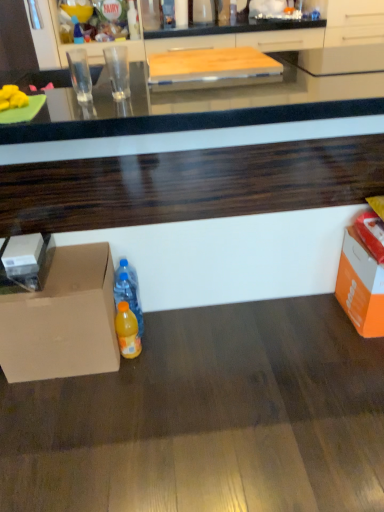
Question: Is yellow matte bananas at left looking in the opposite direction of orange cardboard box at lower right?

Choices:
 (A) yes
 (B) no

Answer: (B)

Question: Considering the relative sizes of yellow matte bananas at left and orange cardboard box at lower right in the image provided, is yellow matte bananas at left shorter than orange cardboard box at lower right?

Choices:
 (A) no
 (B) yes

Answer: (B)

Question: Is yellow matte bananas at left bigger than orange cardboard box at lower right?

Choices:
 (A) yes
 (B) no

Answer: (B)

Question: Is yellow matte bananas at left not near orange cardboard box at lower right?

Choices:
 (A) no
 (B) yes

Answer: (B)

Question: Is yellow matte bananas at left positioned before orange cardboard box at lower right?

Choices:
 (A) yes
 (B) no

Answer: (A)

Question: From the image's perspective, is matte cardboard box at lower left positioned above or below translucent plastic bottle at center, the second bottle in the front-to-back sequence?

Choices:
 (A) below
 (B) above

Answer: (A)

Question: Is point (104, 354) positioned closer to the camera than point (130, 287)?

Choices:
 (A) closer
 (B) farther

Answer: (A)

Question: In the image, is matte cardboard box at lower left on the left side or the right side of translucent plastic bottle at center, which appears as the second bottle when viewed from the top?

Choices:
 (A) right
 (B) left

Answer: (B)

Question: Is matte cardboard box at lower left taller or shorter than translucent plastic bottle at center, which ranks as the second bottle in right-to-left order?

Choices:
 (A) tall
 (B) short

Answer: (A)

Question: From the image's perspective, relative to orange plastic bottle at lower center, the first bottle viewed from the front, is translucent plastic bottle at upper left, which is counted as the 1th bottle, starting from the back, above or below?

Choices:
 (A) below
 (B) above

Answer: (B)

Question: Is translucent plastic bottle at upper left, which is counted as the 1th bottle, starting from the back, wider or thinner than orange plastic bottle at lower center, the 3th bottle when ordered from top to bottom?

Choices:
 (A) wide
 (B) thin

Answer: (A)

Question: From a real-world perspective, is translucent plastic bottle at upper left, marked as the first bottle in a top-to-bottom arrangement, physically located above or below orange plastic bottle at lower center, marked as the 3th bottle in a back-to-front arrangement?

Choices:
 (A) above
 (B) below

Answer: (A)

Question: In terms of height, does translucent plastic bottle at upper left, marked as the 1th bottle in a left-to-right arrangement, look taller or shorter compared to orange plastic bottle at lower center, the 3th bottle when ordered from top to bottom?

Choices:
 (A) tall
 (B) short

Answer: (B)

Question: Is orange cardboard box at lower right taller or shorter than translucent plastic bottle at upper left, positioned as the third bottle in right-to-left order?

Choices:
 (A) short
 (B) tall

Answer: (B)

Question: From a real-world perspective, is orange cardboard box at lower right above or below translucent plastic bottle at upper left, placed as the 3th bottle when sorted from front to back?

Choices:
 (A) above
 (B) below

Answer: (B)